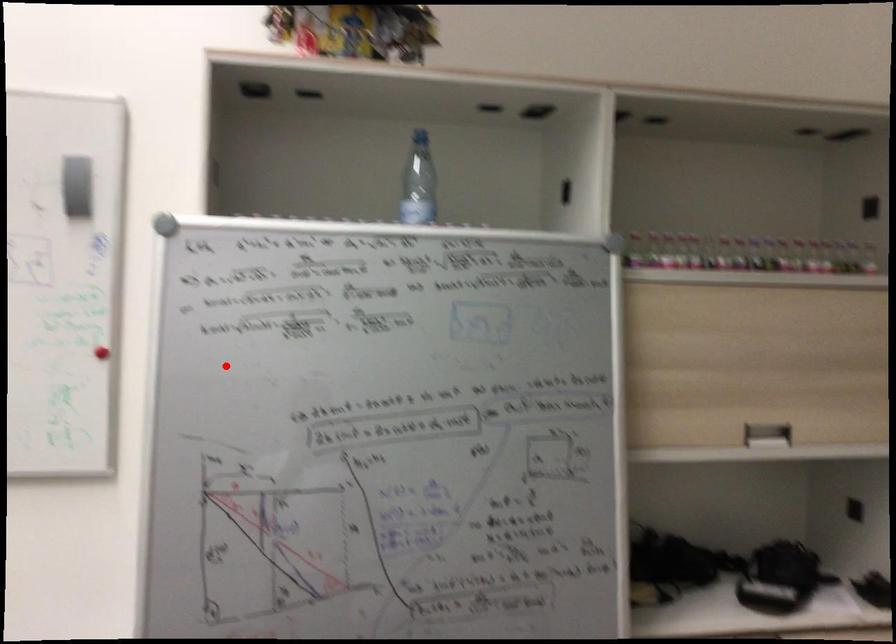
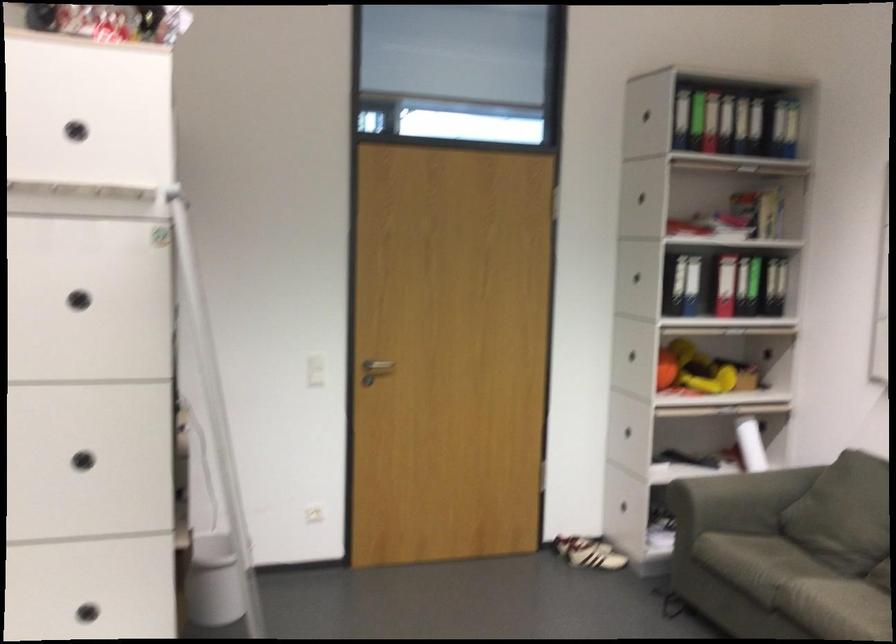
Where in the second image is the point corresponding to the highlighted location from the first image?

(80, 288)